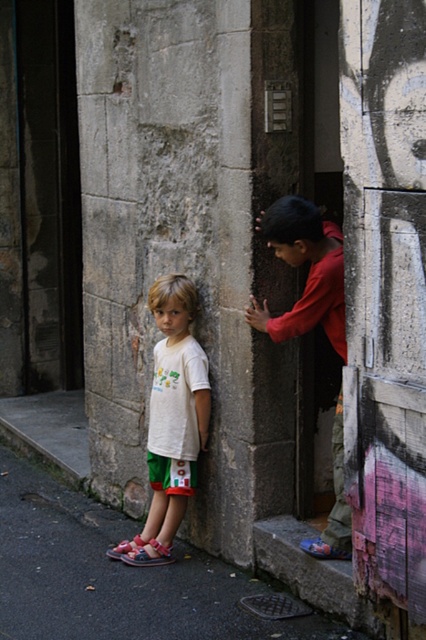
Question: Does concrete textured pillar at center appear on the left side of red cotton shirt at center?

Choices:
 (A) yes
 (B) no

Answer: (B)

Question: Which point appears farthest from the camera in this image?

Choices:
 (A) (305, 221)
 (B) (377, 330)

Answer: (A)

Question: Is concrete textured pillar at center to the right of red cotton shirt at center from the viewer's perspective?

Choices:
 (A) no
 (B) yes

Answer: (B)

Question: Which object is farther from the camera taking this photo?

Choices:
 (A) concrete textured pillar at center
 (B) white cotton shirt at center
 (C) red cotton shirt at center

Answer: (B)

Question: Which of these objects is positioned farthest from the concrete textured pillar at center?

Choices:
 (A) white cotton shirt at center
 (B) red cotton shirt at center

Answer: (A)

Question: Is concrete textured pillar at center positioned at the back of red cotton shirt at center?

Choices:
 (A) yes
 (B) no

Answer: (B)